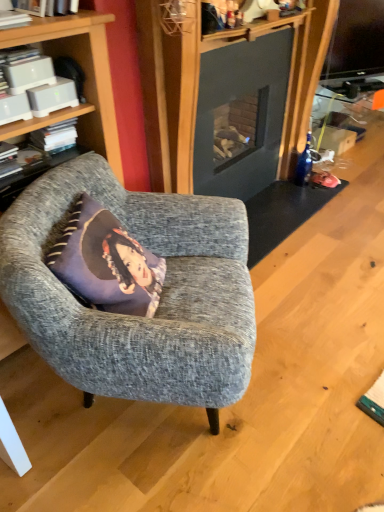
Question: From a real-world perspective, is white plastic book at upper left, which appears as the 2th book when viewed from the front, over white matte book at upper left, which is the first book from front to back?

Choices:
 (A) yes
 (B) no

Answer: (B)

Question: Is white plastic book at upper left, the second book positioned from the back, smaller than white matte book at upper left, which is the first book from front to back?

Choices:
 (A) no
 (B) yes

Answer: (A)

Question: From a real-world perspective, is white plastic book at upper left, which appears as the 2th book when viewed from the front, beneath white matte book at upper left, which is the 3th book from back to front?

Choices:
 (A) no
 (B) yes

Answer: (B)

Question: Is white plastic book at upper left, which appears as the 2th book when viewed from the front, at the right side of white matte book at upper left, which is the 3th book from back to front?

Choices:
 (A) yes
 (B) no

Answer: (A)

Question: Is white matte book at upper left, which is the 3th book from back to front, a part of white plastic book at upper left, which appears as the 2th book when viewed from the front?

Choices:
 (A) yes
 (B) no

Answer: (B)

Question: From a real-world perspective, is dark gray fabric cushion at left physically located above or below purple fabric pillow at center?

Choices:
 (A) below
 (B) above

Answer: (B)

Question: Choose the correct answer: Is dark gray fabric cushion at left inside purple fabric pillow at center or outside it?

Choices:
 (A) inside
 (B) outside

Answer: (B)

Question: Considering the relative positions of dark gray fabric cushion at left and purple fabric pillow at center in the image provided, is dark gray fabric cushion at left to the left or to the right of purple fabric pillow at center?

Choices:
 (A) right
 (B) left

Answer: (B)

Question: Looking at their shapes, would you say dark gray fabric cushion at left is wider or thinner than purple fabric pillow at center?

Choices:
 (A) wide
 (B) thin

Answer: (B)

Question: Considering the positions of white matte book at left, positioned as the first book in back-to-front order, and textured gray armchair at left in the image, is white matte book at left, positioned as the first book in back-to-front order, taller or shorter than textured gray armchair at left?

Choices:
 (A) short
 (B) tall

Answer: (A)

Question: Is point (36, 141) closer or farther from the camera than point (8, 304)?

Choices:
 (A) farther
 (B) closer

Answer: (A)

Question: From a real-world perspective, relative to textured gray armchair at left, is white matte book at left, positioned as the first book in back-to-front order, vertically above or below?

Choices:
 (A) below
 (B) above

Answer: (B)

Question: From the image's perspective, is white matte book at left, positioned as the first book in back-to-front order, located above or below textured gray armchair at left?

Choices:
 (A) below
 (B) above

Answer: (B)

Question: Based on their positions, is white matte book at upper left, which is the 3th book from back to front, located to the left or right of purple fabric pillow at center?

Choices:
 (A) left
 (B) right

Answer: (A)

Question: In terms of width, does white matte book at upper left, which is the first book from front to back, look wider or thinner when compared to purple fabric pillow at center?

Choices:
 (A) thin
 (B) wide

Answer: (A)